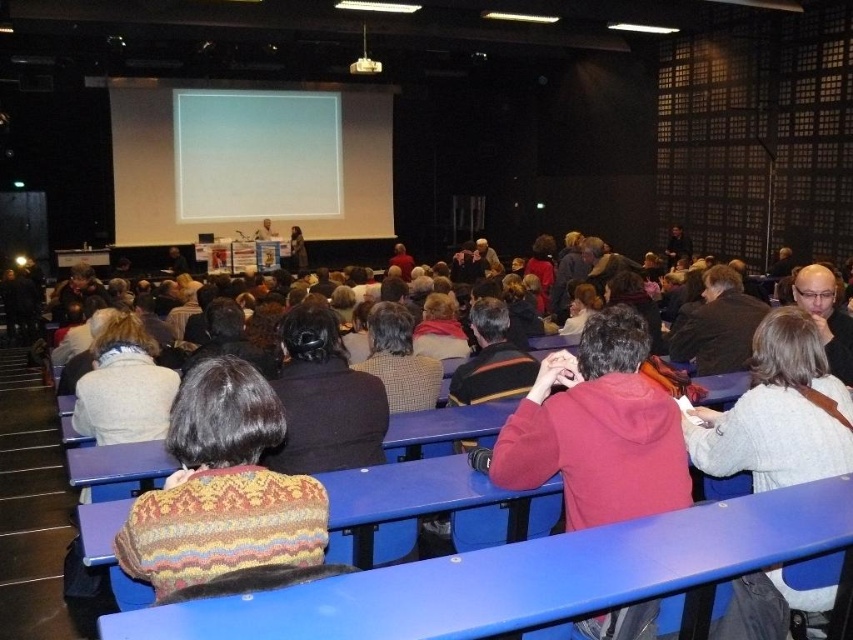
Question: Which point appears farthest from the camera in this image?

Choices:
 (A) (260, 205)
 (B) (300, 429)
 (C) (210, 548)
 (D) (711, 276)

Answer: (A)

Question: Among these points, which one is nearest to the camera?

Choices:
 (A) (283, 118)
 (B) (728, 324)
 (C) (345, 413)
 (D) (767, 356)

Answer: (D)

Question: Does white matte projection screen at upper center appear on the right side of dark brown leather jacket at center?

Choices:
 (A) no
 (B) yes

Answer: (A)

Question: Can you confirm if knitted sweater at center is positioned to the right of white fuzzy sweater at center?

Choices:
 (A) no
 (B) yes

Answer: (A)

Question: Which point is farther to the camera?

Choices:
 (A) (352, 65)
 (B) (817, 452)

Answer: (A)

Question: Can you confirm if white matte projection screen at upper center is positioned to the right of dark brown hair at center?

Choices:
 (A) yes
 (B) no

Answer: (B)